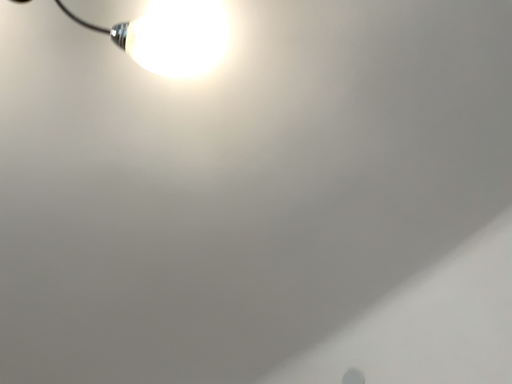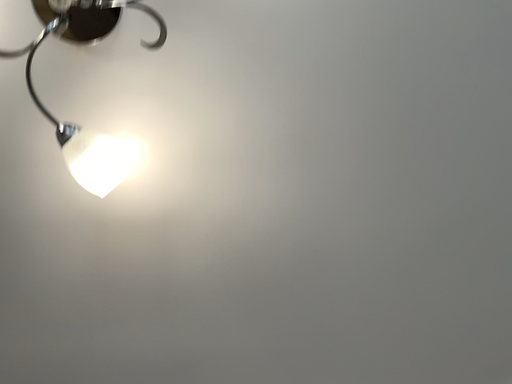
Question: Which way did the camera rotate in the video?

Choices:
 (A) rotated left
 (B) rotated right

Answer: (B)